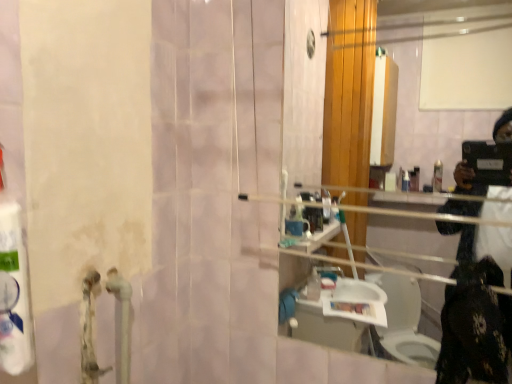
At what (x,y) coordinates should I click in order to perform the action: click on white glossy mirror at upper center. Please return your answer as a coordinate pair (x, y). The image size is (512, 384). Looking at the image, I should click on 300,84.

What do you see at coordinates (300, 84) in the screenshot?
I see `white glossy mirror at upper center` at bounding box center [300, 84].

This screenshot has height=384, width=512. What are the coordinates of `white glossy mirror at upper center` in the screenshot? It's located at (300, 84).